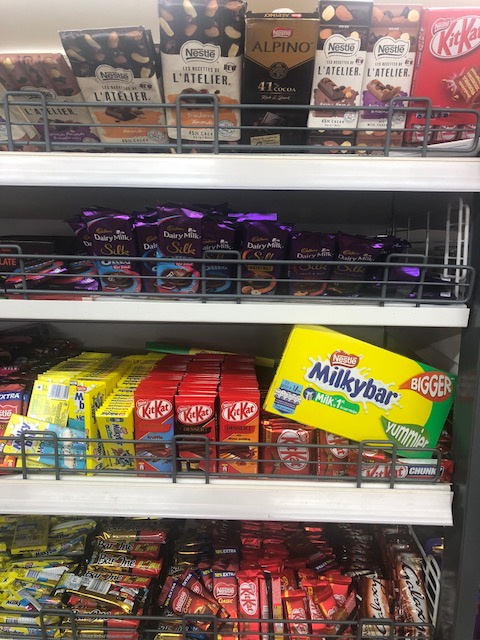
I want to click on side shelf rail, so click(469, 481).